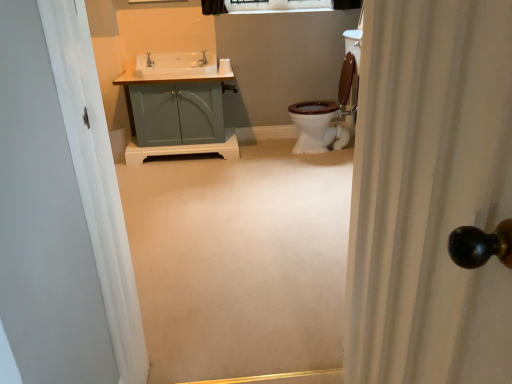
Question: Is matte silver faucet at upper center aimed at clear glass window at upper center?

Choices:
 (A) yes
 (B) no

Answer: (B)

Question: Can you confirm if matte silver faucet at upper center is thinner than clear glass window at upper center?

Choices:
 (A) yes
 (B) no

Answer: (B)

Question: From a real-world perspective, is matte silver faucet at upper center over clear glass window at upper center?

Choices:
 (A) no
 (B) yes

Answer: (A)

Question: Does matte silver faucet at upper center have a lesser height compared to clear glass window at upper center?

Choices:
 (A) yes
 (B) no

Answer: (B)

Question: Is the depth of matte silver faucet at upper center greater than that of clear glass window at upper center?

Choices:
 (A) no
 (B) yes

Answer: (A)

Question: Relative to matte silver faucet at upper center, is clear glass window at upper center in front or behind?

Choices:
 (A) front
 (B) behind

Answer: (B)

Question: Considering the positions of clear glass window at upper center and matte silver faucet at upper center in the image, is clear glass window at upper center bigger or smaller than matte silver faucet at upper center?

Choices:
 (A) big
 (B) small

Answer: (A)

Question: From a real-world perspective, relative to matte silver faucet at upper center, is clear glass window at upper center vertically above or below?

Choices:
 (A) below
 (B) above

Answer: (B)

Question: Which is correct: clear glass window at upper center is inside matte silver faucet at upper center, or outside of it?

Choices:
 (A) inside
 (B) outside

Answer: (B)

Question: In the image, is white textured shower curtain at right on the left side or the right side of matte teal cabinet at center?

Choices:
 (A) left
 (B) right

Answer: (B)

Question: Is white textured shower curtain at right in front of or behind matte teal cabinet at center in the image?

Choices:
 (A) behind
 (B) front

Answer: (B)

Question: From a real-world perspective, is white textured shower curtain at right physically located above or below matte teal cabinet at center?

Choices:
 (A) below
 (B) above

Answer: (B)

Question: Considering the positions of white textured shower curtain at right and matte teal cabinet at center in the image, is white textured shower curtain at right taller or shorter than matte teal cabinet at center?

Choices:
 (A) tall
 (B) short

Answer: (A)

Question: Visually, is matte silver faucet at upper left positioned to the left or to the right of clear glass window at upper center?

Choices:
 (A) left
 (B) right

Answer: (A)

Question: Would you say matte silver faucet at upper left is inside or outside clear glass window at upper center?

Choices:
 (A) inside
 (B) outside

Answer: (B)